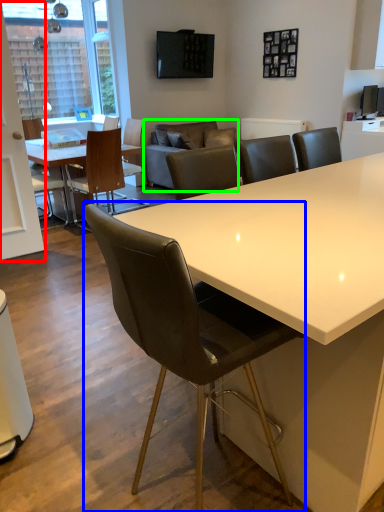
Question: Estimate the real-world distances between objects in this image. Which object is farther from glass door (highlighted by a red box), chair (highlighted by a blue box) or couch (highlighted by a green box)?

Choices:
 (A) chair
 (B) couch

Answer: (A)